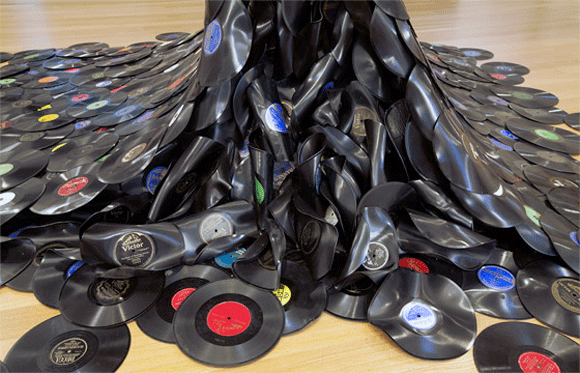
Identify the location of empty space on hardwood floor. (333, 348), (151, 356), (17, 305), (41, 22), (117, 18), (455, 20), (539, 29), (552, 59).